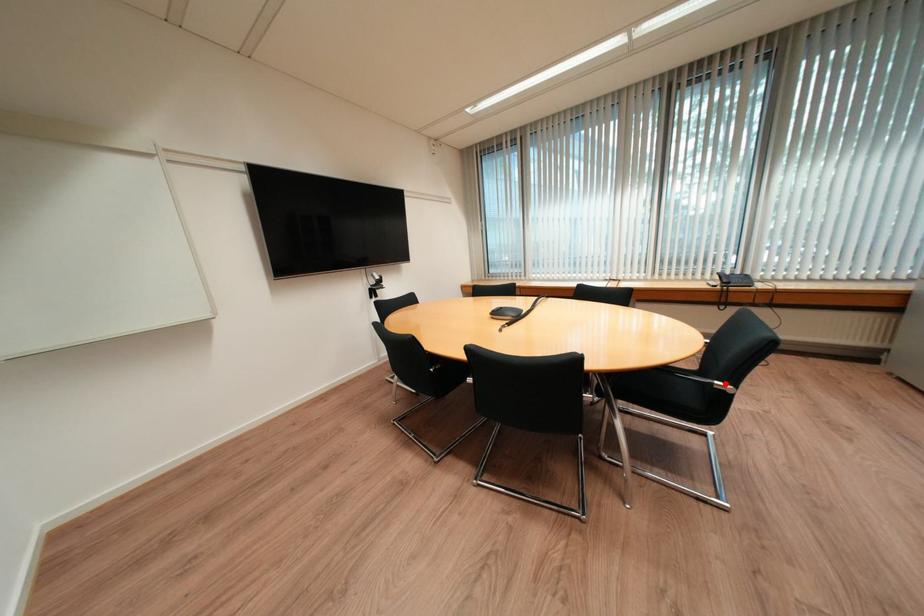
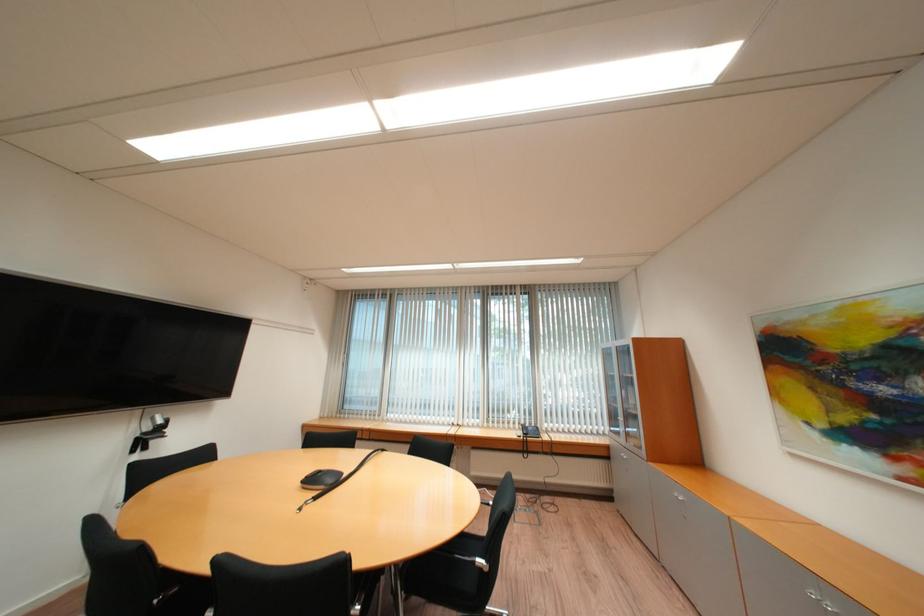
Question: I am providing you with two images of the same scene from different viewpoints. Image1 has a red point marked. In image2, the corresponding 3D location appears at what relative position? Reply with the corresponding letter.

Choices:
 (A) Closer
 (B) Farther

Answer: (A)